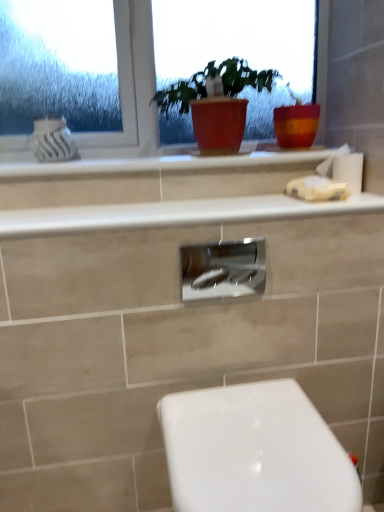
The image size is (384, 512). What are the coordinates of `free point above white glossy toilet at lower right (from a real-world perspective)` in the screenshot? It's located at (248, 436).